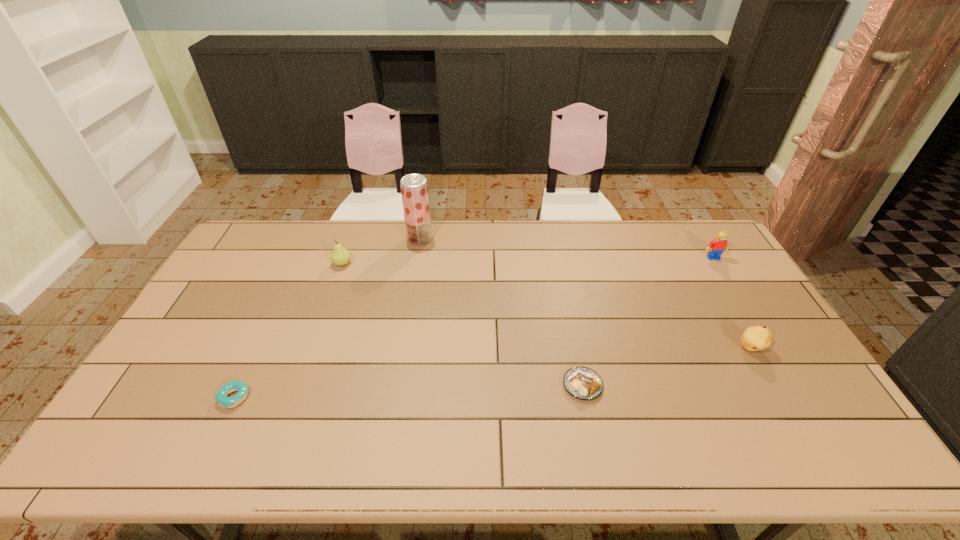
Locate an element on the screen. The width and height of the screenshot is (960, 540). free space that satisfies the following two spatial constraints: 1. on the front side of the second object from left to right; 2. on the left side of the right pear is located at coordinates click(312, 348).